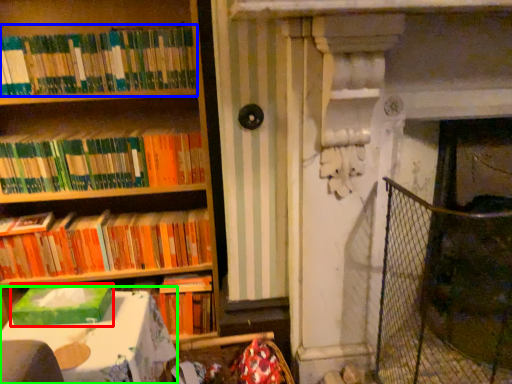
Question: Estimate the real-world distances between objects in this image. Which object is farther from paperback book (highlighted by a red box), book (highlighted by a blue box) or table (highlighted by a green box)?

Choices:
 (A) book
 (B) table

Answer: (A)